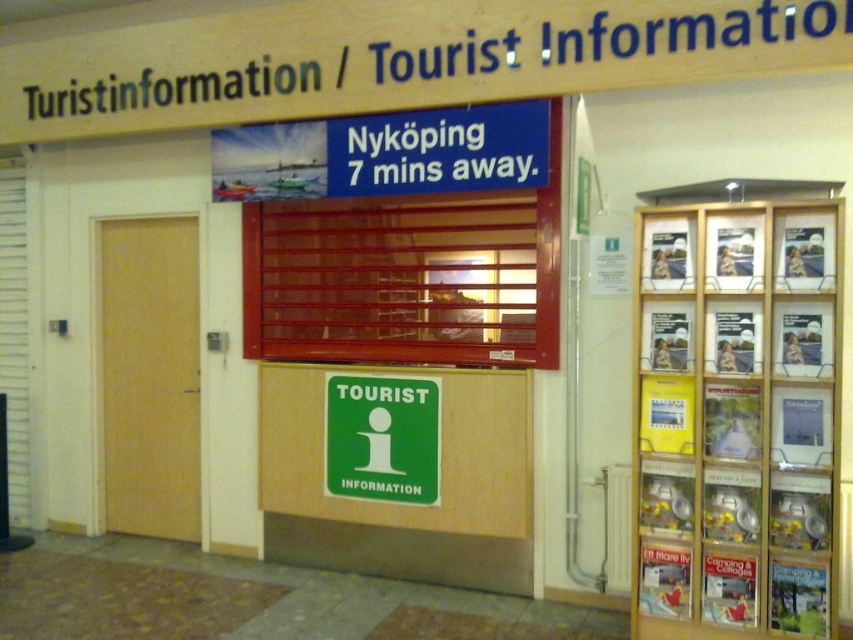
You are a tourist holding a map and standing at the entrance of the Tourist Information Center. You need to enter the building through the wooden door at left. Before entering, you notice the wooden frame brochure rack at right. Which object is wider from your perspective?

The wooden frame brochure rack at right is wider than the wooden door at left.

You are standing in front of the entrance to the tourist information center and want to enter. The wooden door at left and the green matte sign at center are both in your line of sight. Which object is closer to you?

The wooden door at left is closer to you because it is further to the viewer than the green matte sign at center, meaning it is positioned nearer in your line of sight.